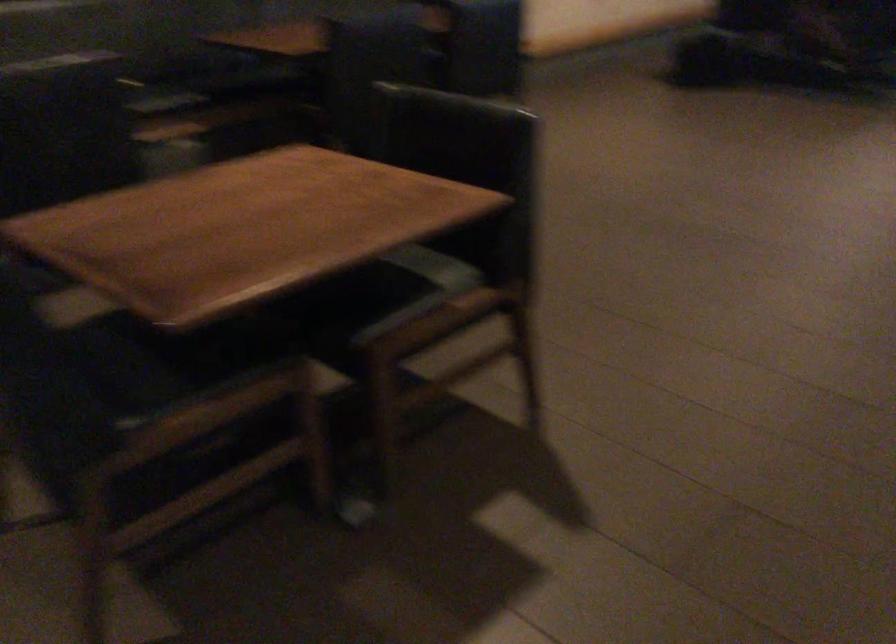
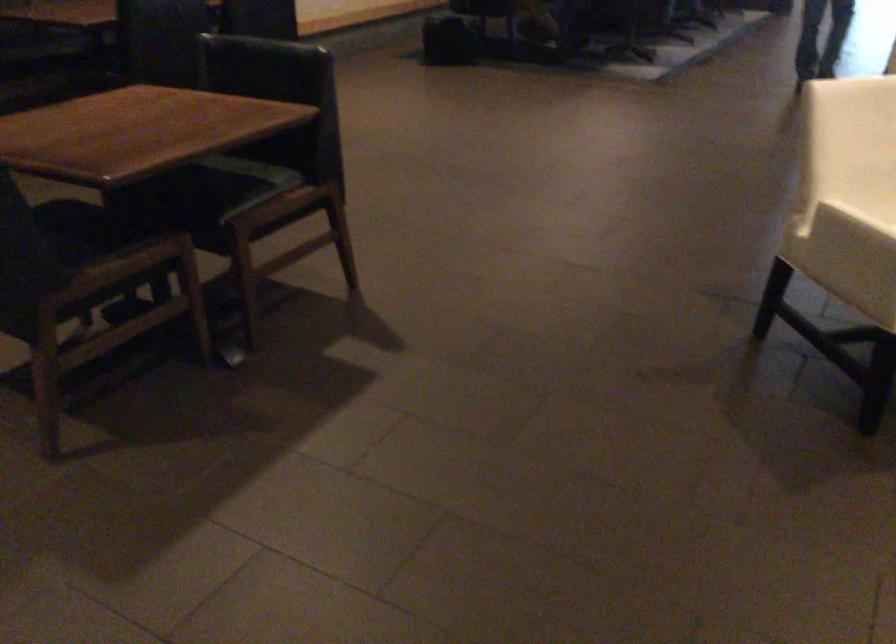
Question: Which direction would the cameraman need to move to produce the second image? Reply with the corresponding letter.

Choices:
 (A) Left
 (B) Right
 (C) Forward
 (D) Backward

Answer: (D)